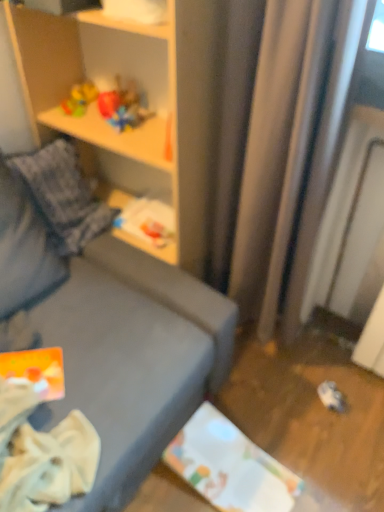
What are the coordinates of `rubberized plastic toy at upper left` in the screenshot? It's located at (79, 99).

This screenshot has height=512, width=384. Describe the element at coordinates (79, 99) in the screenshot. I see `rubberized plastic toy at upper left` at that location.

Find the location of a particular element. The image size is (384, 512). wooden shelf at upper left is located at coordinates (148, 102).

Describe the element at coordinates (148, 102) in the screenshot. This screenshot has height=512, width=384. I see `wooden shelf at upper left` at that location.

You are a GUI agent. You are given a task and a screenshot of the screen. Output one action in this format:
    pyautogui.click(x=<x>, y=<y>)
    Task: Click on the rubberized plastic toy at upper left
    The height and width of the screenshot is (512, 384).
    Given the screenshot: What is the action you would take?
    pyautogui.click(x=79, y=99)

Based on the photo, is rubberized plastic toy at upper left at the right side of wooden shelf at upper left?

No, rubberized plastic toy at upper left is not to the right of wooden shelf at upper left.

Which object is more forward, rubberized plastic toy at upper left or wooden shelf at upper left?

wooden shelf at upper left is in front.

Which is in front, point (68, 105) or point (107, 177)?

Point (68, 105)

From the image's perspective, does rubberized plastic toy at upper left appear lower than wooden shelf at upper left?

Actually, rubberized plastic toy at upper left appears above wooden shelf at upper left in the image.

From a real-world perspective, between rubberized plastic toy at upper left and wooden shelf at upper left, who is vertically lower?

From a 3D spatial view, wooden shelf at upper left is below.

Can you confirm if rubberized plastic toy at upper left is thinner than wooden shelf at upper left?

Indeed, rubberized plastic toy at upper left has a lesser width compared to wooden shelf at upper left.

Does rubberized plastic toy at upper left have a greater height compared to wooden shelf at upper left?

Incorrect, the height of rubberized plastic toy at upper left is not larger of that of wooden shelf at upper left.

Is rubberized plastic toy at upper left bigger than wooden shelf at upper left?

No.

Would you say rubberized plastic toy at upper left contains wooden shelf at upper left?

Actually, wooden shelf at upper left is outside rubberized plastic toy at upper left.

From the picture: Is rubberized plastic toy at upper left not near wooden shelf at upper left?

rubberized plastic toy at upper left is actually quite close to wooden shelf at upper left.

Is wooden shelf at upper left at the back of rubberized plastic toy at upper left?

Yes, rubberized plastic toy at upper left is positioned with its back facing wooden shelf at upper left.

Measure the distance from rubberized plastic toy at upper left to wooden shelf at upper left.

rubberized plastic toy at upper left and wooden shelf at upper left are 11.60 inches apart.

Identify the location of toy behind the wooden shelf at upper left. Image resolution: width=384 pixels, height=512 pixels. (79, 99).

In the scene shown: Considering the positions of objects wooden shelf at upper left and rubberized plastic toy at upper left in the image provided, who is more to the right, wooden shelf at upper left or rubberized plastic toy at upper left?

wooden shelf at upper left is more to the right.

Is the depth of wooden shelf at upper left less than that of rubberized plastic toy at upper left?

Yes.

Which is behind, point (73, 50) or point (71, 111)?

The point (73, 50) is farther.

From the image's perspective, who appears lower, wooden shelf at upper left or rubberized plastic toy at upper left?

From the image's view, wooden shelf at upper left is below.

From a real-world perspective, is wooden shelf at upper left positioned above or below rubberized plastic toy at upper left?

In terms of real-world spatial position, wooden shelf at upper left is below rubberized plastic toy at upper left.

Which of these two, wooden shelf at upper left or rubberized plastic toy at upper left, is thinner?

With smaller width is rubberized plastic toy at upper left.

Considering the sizes of objects wooden shelf at upper left and rubberized plastic toy at upper left in the image provided, who is shorter, wooden shelf at upper left or rubberized plastic toy at upper left?

Standing shorter between the two is rubberized plastic toy at upper left.

In the scene shown: Can you confirm if wooden shelf at upper left is smaller than rubberized plastic toy at upper left?

No.

Is wooden shelf at upper left located outside rubberized plastic toy at upper left?

Yes, wooden shelf at upper left is not within rubberized plastic toy at upper left.

Is wooden shelf at upper left touching rubberized plastic toy at upper left?

They are not placed beside each other.

Is wooden shelf at upper left looking in the opposite direction of rubberized plastic toy at upper left?

Yes, rubberized plastic toy at upper left is at the back of wooden shelf at upper left.

Locate an element on the screen. This screenshot has width=384, height=512. shelf lying in front of the rubberized plastic toy at upper left is located at coordinates (148, 102).

I want to click on shelf in front of the rubberized plastic toy at upper left, so click(x=148, y=102).

Find the location of a particular element. This screenshot has height=512, width=384. shelf below the rubberized plastic toy at upper left (from a real-world perspective) is located at coordinates (148, 102).